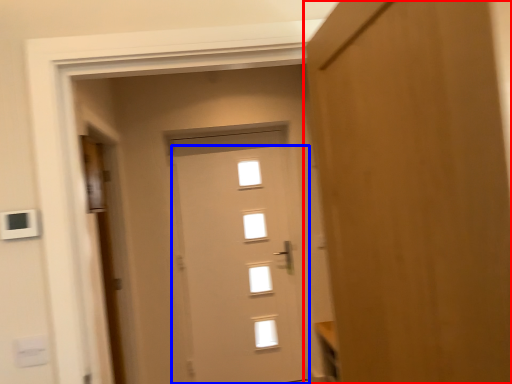
Question: Which object appears farthest to the camera in this image, door (highlighted by a red box) or door (highlighted by a blue box)?

Choices:
 (A) door
 (B) door

Answer: (B)